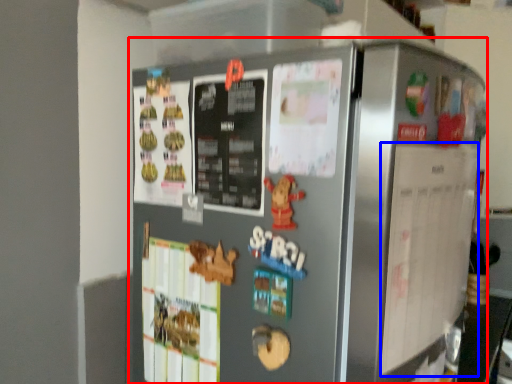
Question: Which object is further to the camera taking this photo, refrigerator (highlighted by a red box) or bulletin board (highlighted by a blue box)?

Choices:
 (A) refrigerator
 (B) bulletin board

Answer: (B)